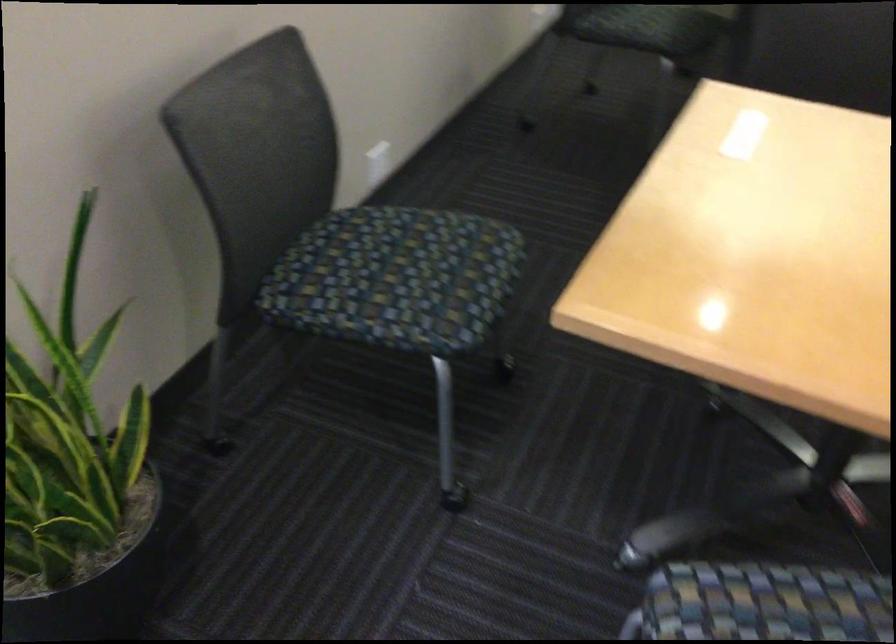
This screenshot has width=896, height=644. Identify the location of dark chair seat. coord(649,28).